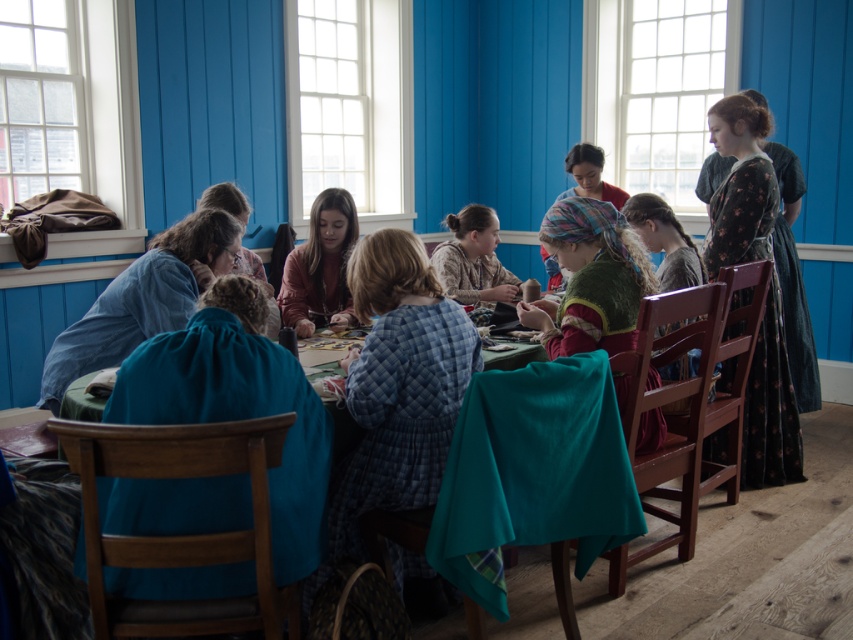
You are organizing a small craft fair and need to display the floral fabric dress at center and the multicolored fabric headscarf at center on a single mannequin. Which item will require more horizontal space on the mannequin?

The floral fabric dress at center requires more horizontal space on the mannequin because its width is larger than the multicolored fabric headscarf at center.

You are standing in the room and want to reach both the point at coordinates point (341, 312) and point (659, 268). Which point should you reach first if you are moving forward in a straight line?

You should reach point (341, 312) first because it is closer to the camera than point (659, 268).

You are a tailor in the room and need to retrieve the floral fabric dress at center to adjust its hem. However, the multicolored fabric headscarf at center is blocking your access. Can you lift the headscarf to reach the dress?

The floral fabric dress at center is positioned under the multicolored fabric headscarf at center, so you can lift the headscarf to access the dress.